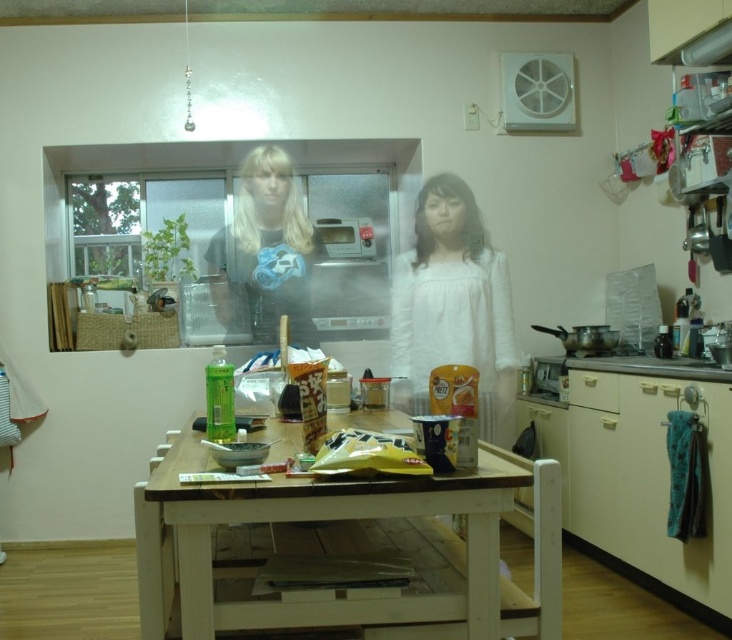
You are a photographer setting up a shoot in the kitchen. You want to place a 10cm wide decorative item between the white cotton shirt at center and the blonde hair at center. Can you fit it there?

The white cotton shirt at center is thinner than blonde hair at center, so the space between them may be sufficient to fit a 10cm wide decorative item.

You are standing in the kitchen and want to place a small plant on the wooden table at center. Where should you place it to avoid the existing items? The coordinates of the existing items are marked as point (343, 550). Please provide the coordinates of an empty space on the table.

The point (343, 550) is on the wooden table at center, so you can place the plant at coordinates like 0.6, 0.5 or 0.4, 0.6 to avoid the existing items.

You are standing in the kitchen and want to pick up an item from the table. You notice two points on the table surface. Which point is closer to you, point (143, 531) or point (448, 340)?

Point (143, 531) is closer to you than point (448, 340).